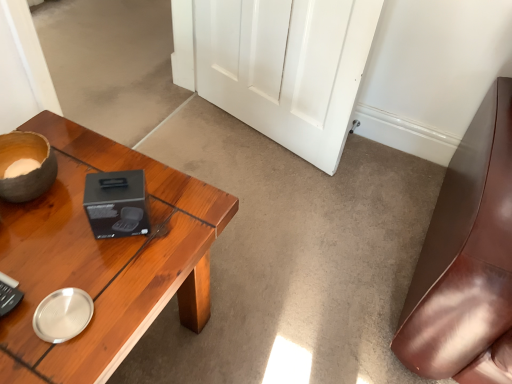
You are a GUI agent. You are given a task and a screenshot of the screen. Output one action in this format:
    pyautogui.click(x=<x>, y=<y>)
    Task: Click on the vacant area that is in front of white glossy door at center
    This screenshot has width=512, height=384.
    Given the screenshot: What is the action you would take?
    pyautogui.click(x=275, y=220)